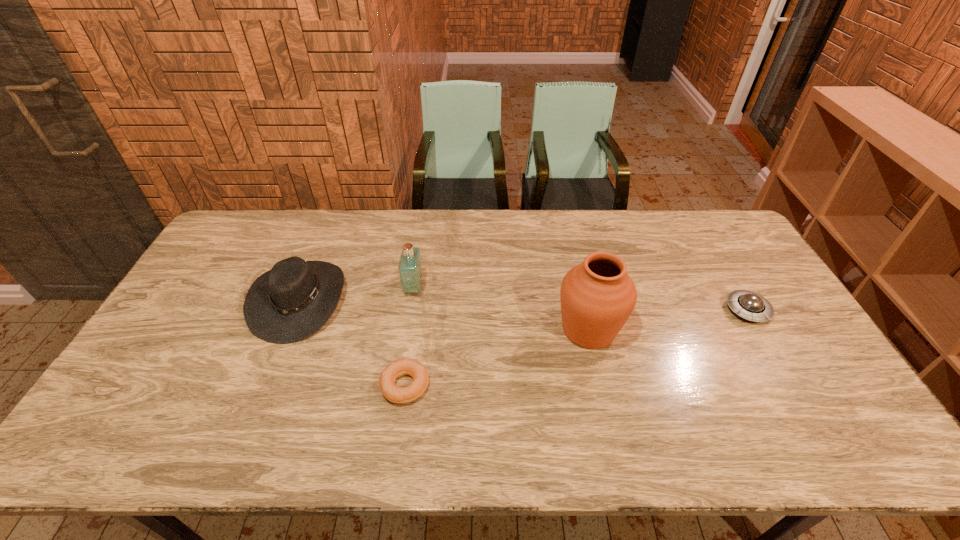
At what (x,y) coordinates should I click in order to perform the action: click on urn. Please return your answer as a coordinate pair (x, y). The image size is (960, 540). Looking at the image, I should click on (597, 296).

The width and height of the screenshot is (960, 540). In order to click on the second object from right to left in this screenshot , I will do `click(597, 296)`.

The image size is (960, 540). What are the coordinates of `perfume` in the screenshot? It's located at (410, 270).

This screenshot has width=960, height=540. What are the coordinates of `cowboy hat` in the screenshot? It's located at (289, 303).

The height and width of the screenshot is (540, 960). Identify the location of the leftmost object. (289, 303).

Locate an element on the screen. The width and height of the screenshot is (960, 540). the rightmost object is located at coordinates (749, 305).

This screenshot has width=960, height=540. I want to click on saucer, so click(749, 305).

Where is `the shortest object`? The image size is (960, 540). the shortest object is located at coordinates (401, 395).

You are a GUI agent. You are given a task and a screenshot of the screen. Output one action in this format:
    pyautogui.click(x=<x>, y=<y>)
    Task: Click on the bagel
    The width and height of the screenshot is (960, 540).
    Given the screenshot: What is the action you would take?
    pyautogui.click(x=401, y=395)

Identify the location of vacant space located on the back of the second object from right to left. The width and height of the screenshot is (960, 540). (565, 228).